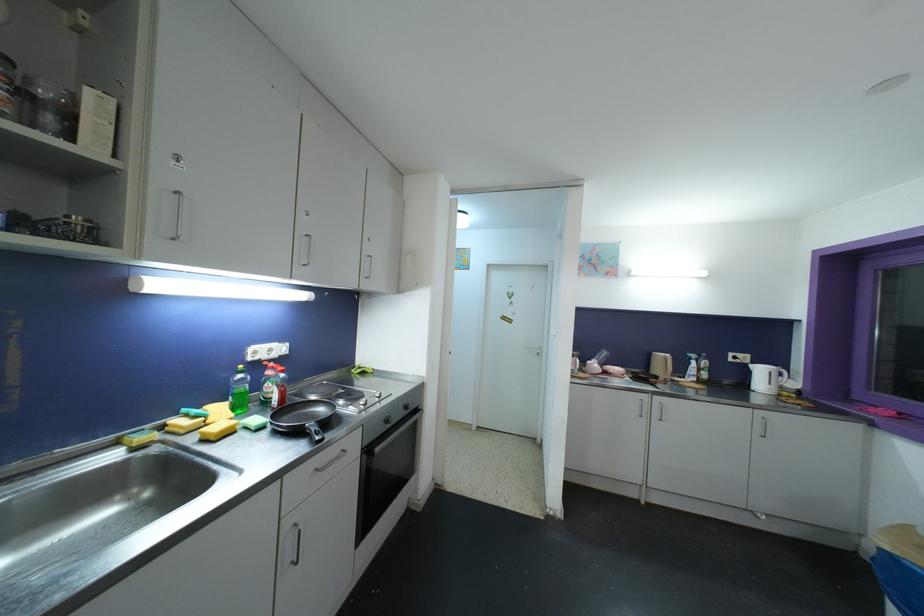
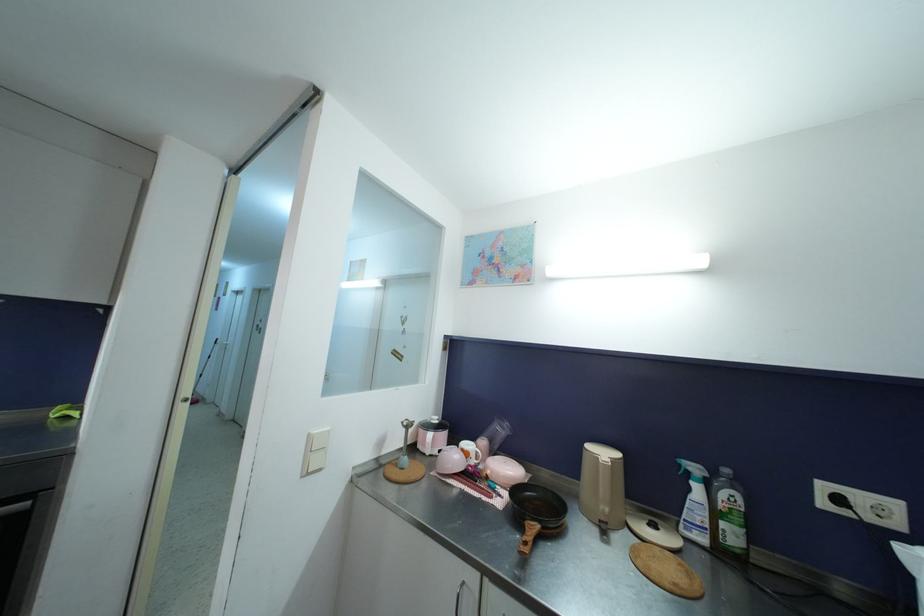
The point at (696,359) is marked in the first image. Where is the corresponding point in the second image?

(699, 472)